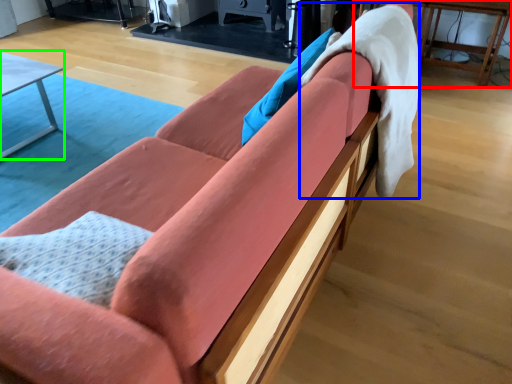
Question: Considering the real-world distances, which object is farthest from table (highlighted by a red box)? blanket (highlighted by a blue box) or table (highlighted by a green box)?

Choices:
 (A) blanket
 (B) table

Answer: (B)